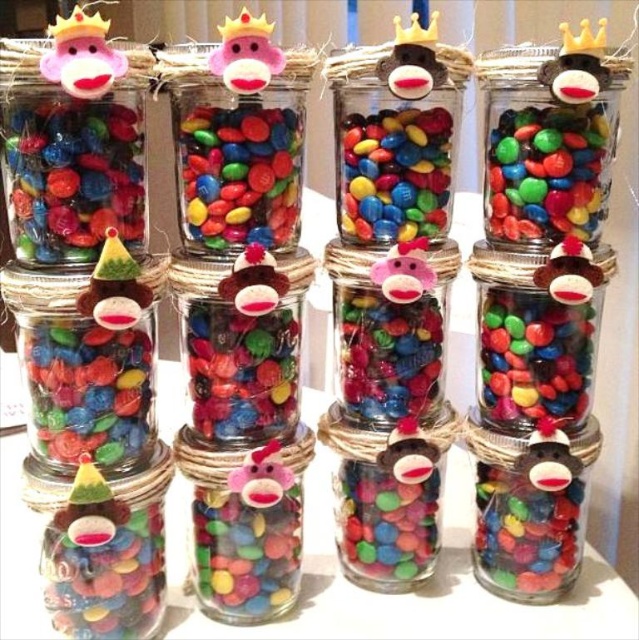
Which is below, shiny multicolored candies at upper right or shiny multicolored candies at center?

shiny multicolored candies at upper right is lower down.

Is shiny multicolored candies at upper right bigger than shiny multicolored candies at center?

Correct, shiny multicolored candies at upper right is larger in size than shiny multicolored candies at center.

Locate an element on the screen. The height and width of the screenshot is (640, 639). shiny multicolored candies at upper right is located at coordinates (548, 172).

Is shiny multicolored buttons at center wider than matte plastic jar at center?

Yes, shiny multicolored buttons at center is wider than matte plastic jar at center.

The height and width of the screenshot is (640, 639). In order to click on shiny multicolored buttons at center in this screenshot , I will do `click(238, 176)`.

Is shiny multicolored buttons at center to the right of shiny multicolored candies at center right from the viewer's perspective?

Incorrect, shiny multicolored buttons at center is not on the right side of shiny multicolored candies at center right.

Does shiny multicolored buttons at center appear over shiny multicolored candies at center right?

Yes, shiny multicolored buttons at center is above shiny multicolored candies at center right.

Where is `shiny multicolored buttons at center`? This screenshot has width=639, height=640. shiny multicolored buttons at center is located at coordinates (238, 176).